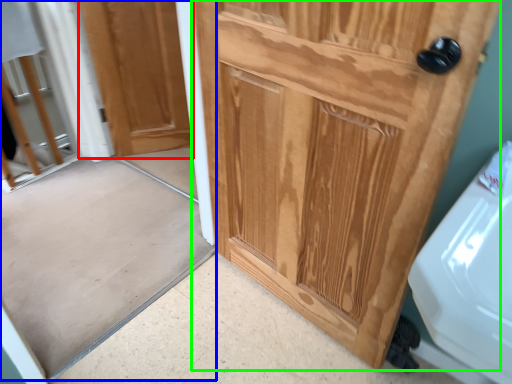
Question: Estimate the real-world distances between objects in this image. Which object is closer to door (highlighted by a red box), screen door (highlighted by a blue box) or door (highlighted by a green box)?

Choices:
 (A) screen door
 (B) door

Answer: (A)